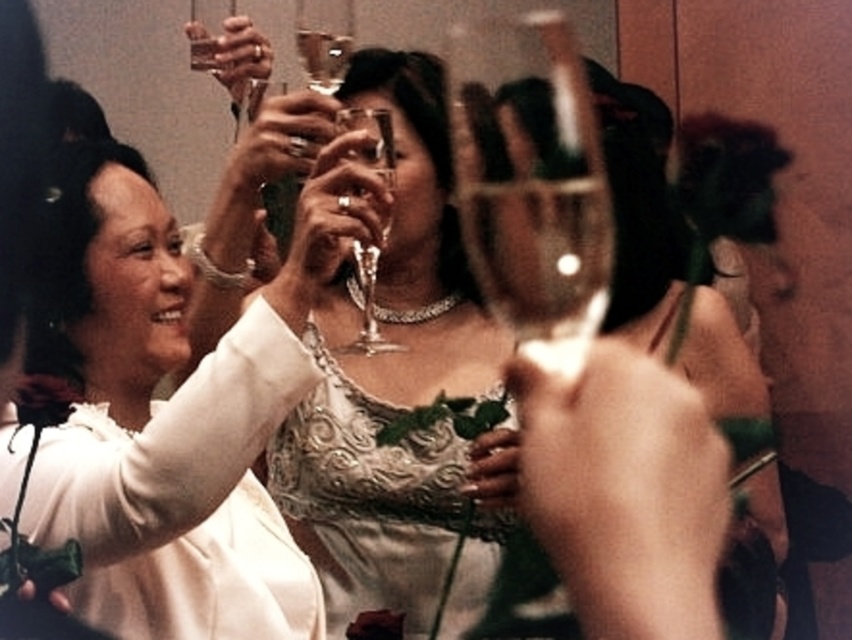
Question: Observing the image, what is the correct spatial positioning of transparent glass wine glass at center in reference to clear glass wine glass at center?

Choices:
 (A) right
 (B) left

Answer: (A)

Question: Does white satin dress at left appear under clear glass wine glass at center?

Choices:
 (A) no
 (B) yes

Answer: (B)

Question: Which of the following is the closest to the observer?

Choices:
 (A) (350, 115)
 (B) (130, 282)

Answer: (B)

Question: Which point appears farthest from the camera in this image?

Choices:
 (A) (321, 24)
 (B) (574, 244)
 (C) (424, 589)

Answer: (B)

Question: Which point is farther to the camera?

Choices:
 (A) [x=171, y=592]
 (B) [x=413, y=467]
 (C) [x=318, y=29]

Answer: (B)

Question: Is white satin dress at left bigger than transparent glass wine glass at center?

Choices:
 (A) no
 (B) yes

Answer: (A)